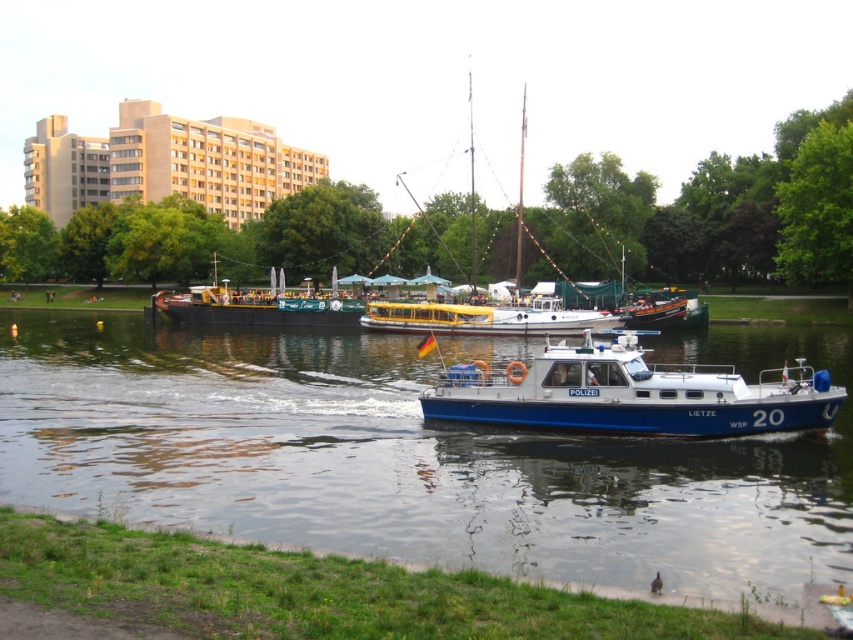
Question: Can you confirm if blue metallic boat at center is bigger than blue metallic police boat at center?

Choices:
 (A) yes
 (B) no

Answer: (A)

Question: Which of these objects is positioned farthest from the green canvas barge at center?

Choices:
 (A) blue metallic boat at center
 (B) blue metallic police boat at center

Answer: (B)

Question: Based on their relative distances, which object is nearer to the yellow matte boat at center?

Choices:
 (A) blue metallic police boat at center
 (B) green canvas barge at center
 (C) blue metallic boat at center

Answer: (C)

Question: Which point is closer to the camera?

Choices:
 (A) blue metallic police boat at center
 (B) yellow matte boat at center

Answer: (A)

Question: Is blue metallic boat at center smaller than blue metallic police boat at center?

Choices:
 (A) no
 (B) yes

Answer: (A)

Question: Can you confirm if blue metallic police boat at center is wider than yellow matte boat at center?

Choices:
 (A) no
 (B) yes

Answer: (B)